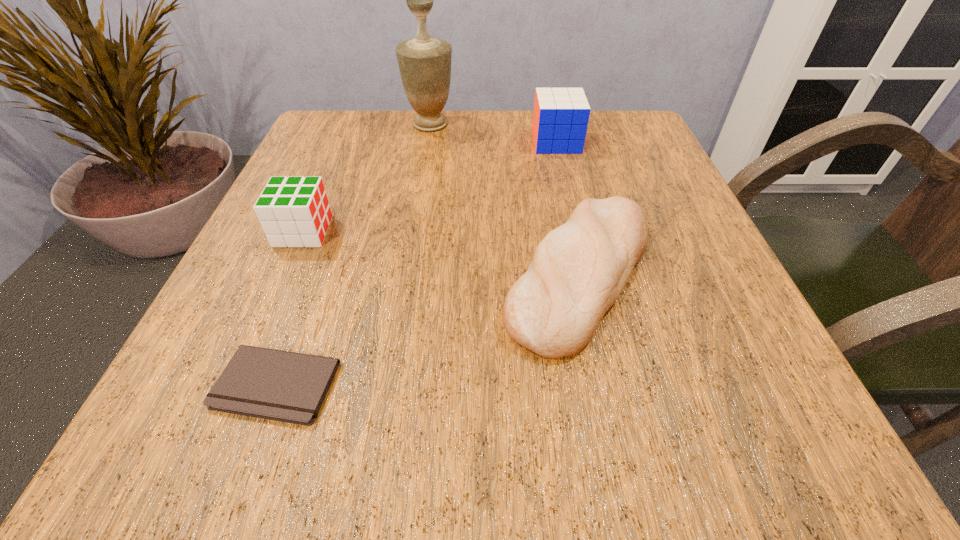
In order to click on object that is at the near left corner in this screenshot , I will do `click(272, 384)`.

Image resolution: width=960 pixels, height=540 pixels. In order to click on object present at the far right corner in this screenshot , I will do `click(560, 119)`.

This screenshot has height=540, width=960. Find the location of `blank space at the near edge of the desktop`. blank space at the near edge of the desktop is located at coordinates (551, 403).

Where is `free space at the left edge of the desktop`? The height and width of the screenshot is (540, 960). free space at the left edge of the desktop is located at coordinates (347, 194).

Identify the location of vacant space at the right edge of the desktop. The image size is (960, 540). (709, 369).

In the image, there is a desktop. At what (x,y) coordinates should I click in order to perform the action: click on vacant space at the far left corner. Please return your answer as a coordinate pair (x, y). Image resolution: width=960 pixels, height=540 pixels. Looking at the image, I should click on (387, 110).

Image resolution: width=960 pixels, height=540 pixels. I want to click on free space at the far right corner, so click(x=611, y=118).

In the image, there is a desktop. At what (x,y) coordinates should I click in order to perform the action: click on vacant space at the near right corner. Please return your answer as a coordinate pair (x, y). Looking at the image, I should click on (745, 437).

This screenshot has width=960, height=540. What are the coordinates of `vacant area that lies between the nearer cube and the bread` in the screenshot? It's located at (442, 253).

Locate an element on the screen. This screenshot has height=540, width=960. unoccupied position between the checkbook and the shorter cube is located at coordinates (290, 308).